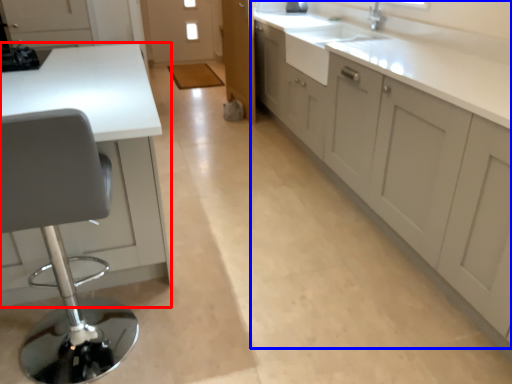
Question: Which point is further to the camera, countertop (highlighted by a red box) or cabinetry (highlighted by a blue box)?

Choices:
 (A) countertop
 (B) cabinetry

Answer: (A)